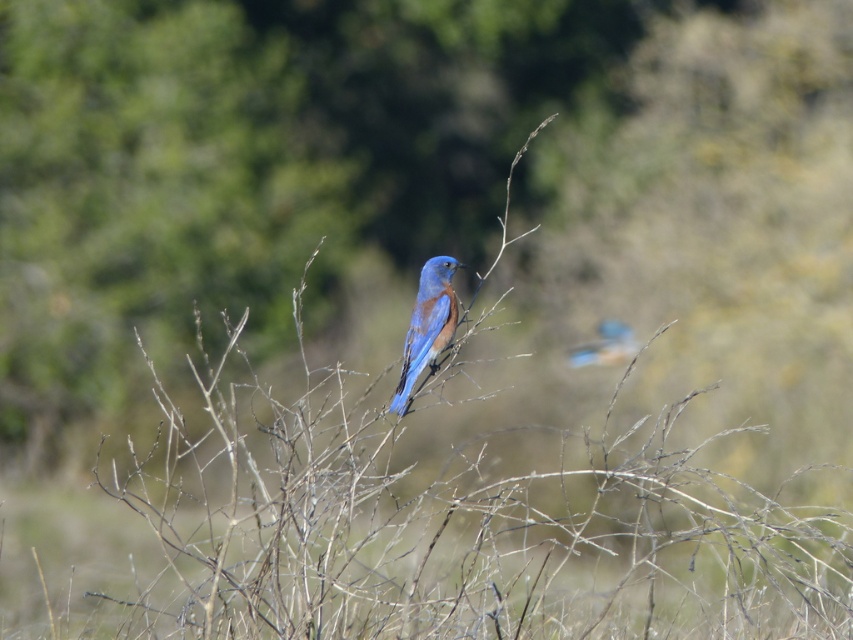
Question: Which of the following is the farthest from the observer?

Choices:
 (A) (399, 374)
 (B) (596, 324)

Answer: (B)

Question: Is blue glossy bird at center to the right of blue glossy bird at upper right from the viewer's perspective?

Choices:
 (A) yes
 (B) no

Answer: (B)

Question: Which point appears farthest from the camera in this image?

Choices:
 (A) (583, 353)
 (B) (418, 365)

Answer: (A)

Question: Which of the following is the closest to the observer?

Choices:
 (A) blue glossy bird at center
 (B) blue glossy bird at upper right

Answer: (A)

Question: Considering the relative positions of blue glossy bird at center and blue glossy bird at upper right in the image provided, where is blue glossy bird at center located with respect to blue glossy bird at upper right?

Choices:
 (A) left
 (B) right

Answer: (A)

Question: Can you confirm if blue glossy bird at center is wider than blue glossy bird at upper right?

Choices:
 (A) no
 (B) yes

Answer: (A)